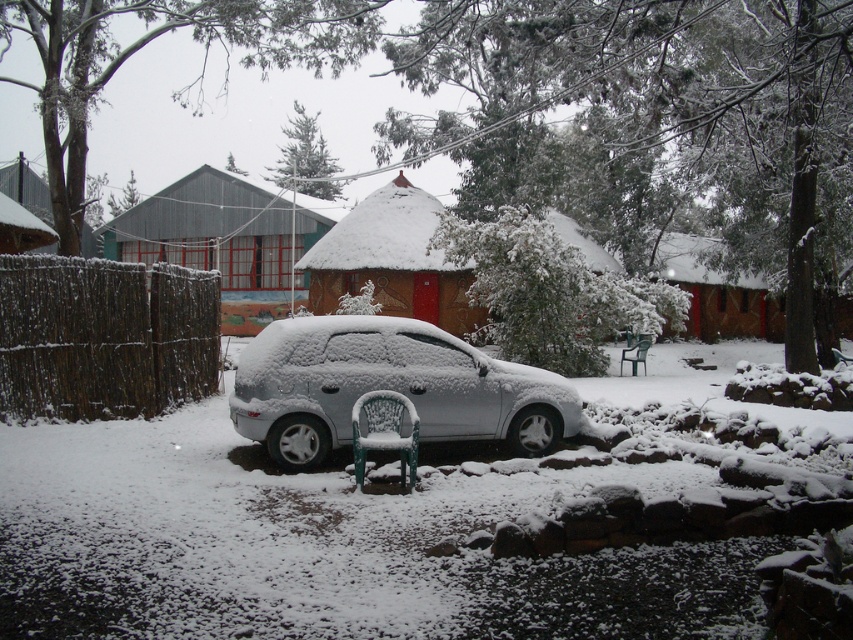
Question: Which object is the farthest from the white matte car at center?

Choices:
 (A) brown thatched hut at center
 (B) wooden thatched hut at center

Answer: (B)

Question: Is white matte car at center smaller than wooden thatched hut at center?

Choices:
 (A) no
 (B) yes

Answer: (B)

Question: Among these objects, which one is farthest from the camera?

Choices:
 (A) white matte car at center
 (B) brown thatched hut at center

Answer: (B)

Question: Which point appears closest to the camera in this image?

Choices:
 (A) (451, 371)
 (B) (405, 289)
 (C) (300, 298)

Answer: (A)

Question: Can you confirm if wooden thatched hut at center is wider than brown thatched hut at center?

Choices:
 (A) yes
 (B) no

Answer: (B)

Question: Is wooden thatched hut at center closer to the viewer compared to brown thatched hut at center?

Choices:
 (A) yes
 (B) no

Answer: (A)